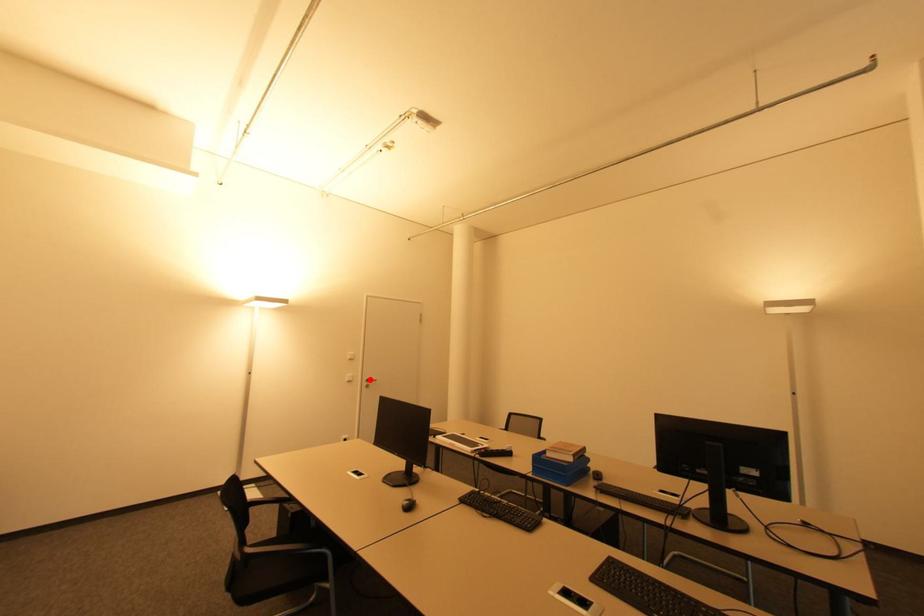
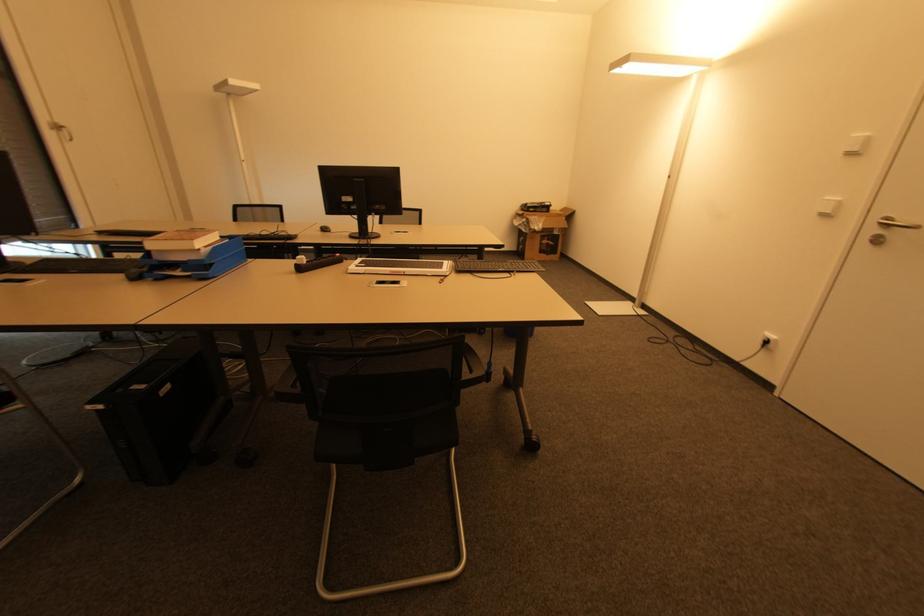
Locate, in the second image, the point that corresponds to the highlighted location in the first image.

(890, 221)